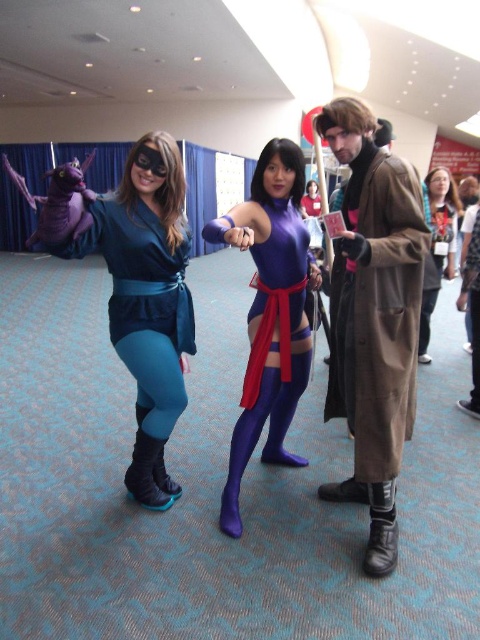
Question: Can you confirm if matte purple dress at center is bigger than matte purple costume at center?

Choices:
 (A) no
 (B) yes

Answer: (B)

Question: Can you confirm if brown leather trench coat at right is wider than matte purple dress at center?

Choices:
 (A) yes
 (B) no

Answer: (B)

Question: Is brown leather trench coat at right positioned at the back of matte blue jumpsuit at center?

Choices:
 (A) no
 (B) yes

Answer: (B)

Question: Among these points, which one is nearest to the camera?

Choices:
 (A) (288, 157)
 (B) (439, 208)
 (C) (314, 193)

Answer: (A)

Question: Which object is farther from the camera taking this photo?

Choices:
 (A) brown leather trench coat at right
 (B) shiny purple bodysuit at center
 (C) matte blue jumpsuit at center

Answer: (A)

Question: Which of the following is the farthest from the observer?

Choices:
 (A) matte blue jumpsuit at center
 (B) shiny purple bodysuit at center

Answer: (B)